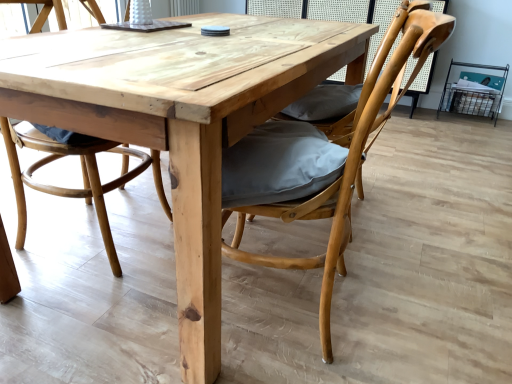
Locate an element on the screen. empty space that is to the right of natural wood table at center is located at coordinates (434, 214).